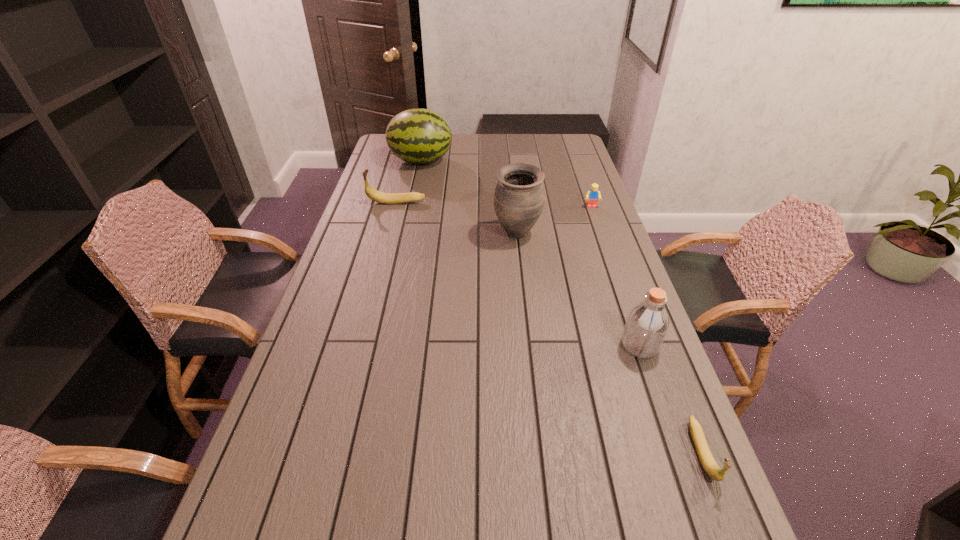
Image resolution: width=960 pixels, height=540 pixels. Find the location of `Lego at the right edge`. Lego at the right edge is located at coordinates (593, 194).

Where is `object situated at the far left corner`? Image resolution: width=960 pixels, height=540 pixels. object situated at the far left corner is located at coordinates (420, 136).

At what (x,y) coordinates should I click in order to perform the action: click on object that is at the near right corner. Please return your answer as a coordinate pair (x, y). Looking at the image, I should click on (710, 466).

Find the location of a particular element. blank area at the far edge is located at coordinates (504, 144).

Where is `free space at the left edge of the desktop`? This screenshot has width=960, height=540. free space at the left edge of the desktop is located at coordinates (381, 167).

Locate an element on the screen. free space at the right edge of the desktop is located at coordinates (574, 169).

At what (x,y) coordinates should I click in order to perform the action: click on free space between the Lego and the fifth farthest object. Please return your answer as a coordinate pair (x, y). Looking at the image, I should click on (615, 276).

Identify the location of free space that is in between the nearest object and the fourth farthest object. This screenshot has width=960, height=540. (610, 343).

Where is `vacant space in between the fourth farthest object and the watermelon`? The height and width of the screenshot is (540, 960). vacant space in between the fourth farthest object and the watermelon is located at coordinates tap(468, 198).

Identify the location of empty space between the watermelon and the left banana. The height and width of the screenshot is (540, 960). coord(409,181).